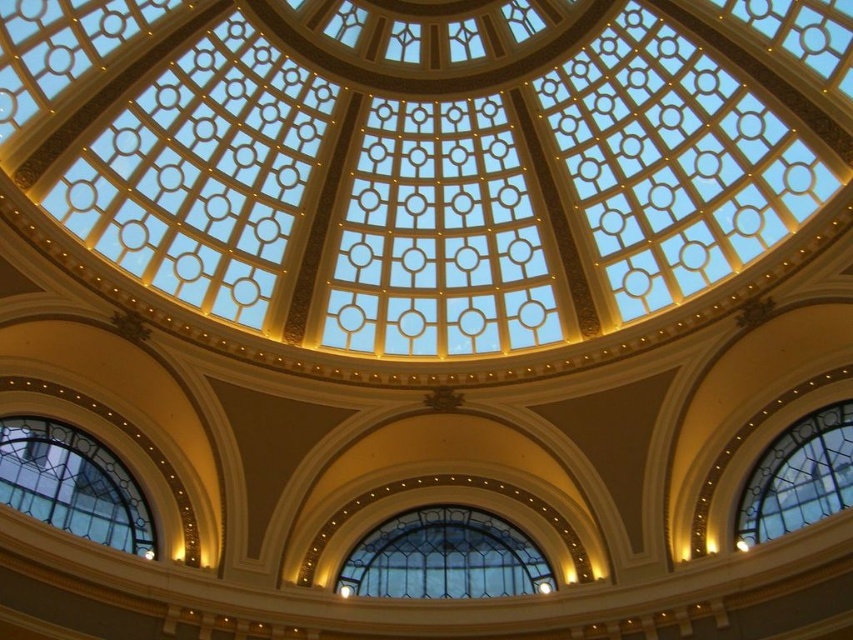
Question: Which of the following is the farthest from the observer?

Choices:
 (A) clear glass window at lower right
 (B) clear glass window at lower left

Answer: (A)

Question: Which point is closer to the camera?

Choices:
 (A) clear glass window at lower right
 (B) clear glass window at center
 (C) clear glass window at lower left

Answer: (C)

Question: Which point is farther to the camera?

Choices:
 (A) (94, 532)
 (B) (759, 536)
 (C) (485, 572)

Answer: (C)

Question: Does clear glass window at lower left appear over clear glass window at lower right?

Choices:
 (A) no
 (B) yes

Answer: (A)

Question: Is clear glass window at lower left to the right of clear glass window at lower right from the viewer's perspective?

Choices:
 (A) yes
 (B) no

Answer: (B)

Question: Can you confirm if clear glass window at lower left is bigger than clear glass window at lower right?

Choices:
 (A) yes
 (B) no

Answer: (A)